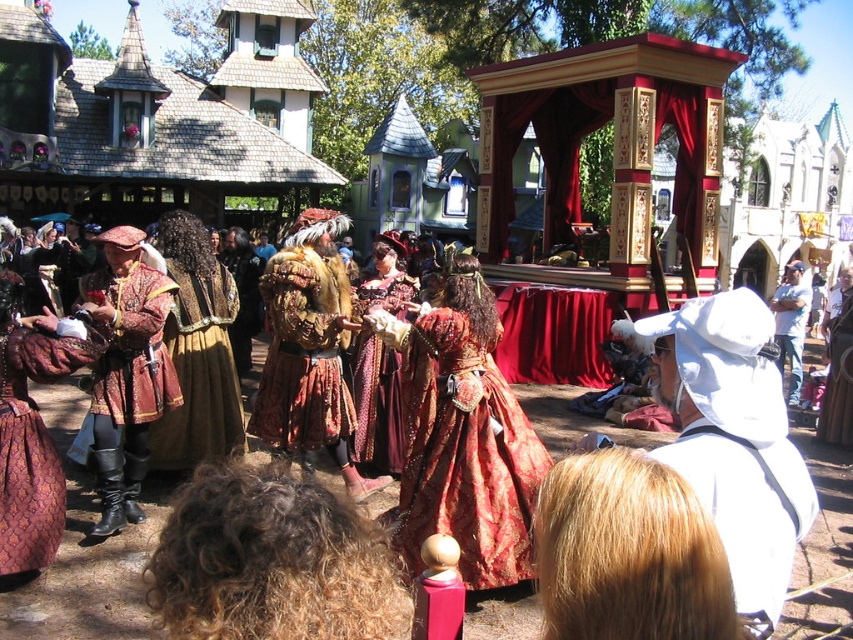
You are a costume designer observing the Renaissance fair scene. You need to determine the spatial relationship between the velvet brocade dress at center and the white cotton hat at right. Based on the scene, which object is positioned lower in the image?

The velvet brocade dress at center is located below the white cotton hat at right, so the velvet brocade dress at center is positioned lower in the image.

You are a performer at the Renaissance fair and need to move from your current position to the central figure. You notice two points marked in the scene. The first point is at coordinate point(503, 474) and the second is at point(338, 365). Which point should you move towards to get closer to the central figure?

You should move towards point(503, 474) because it is in front of point(338, 365), meaning it is closer to the central figure.